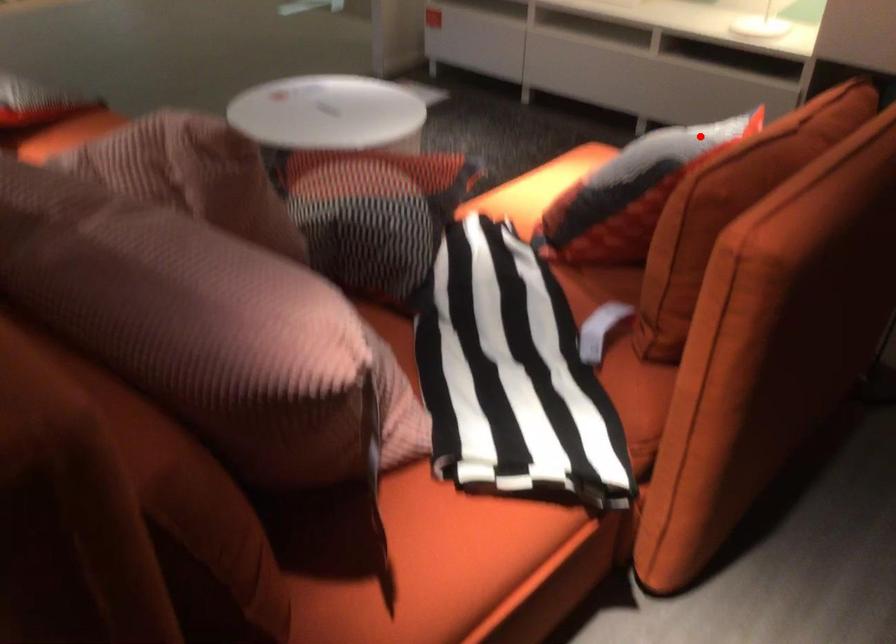
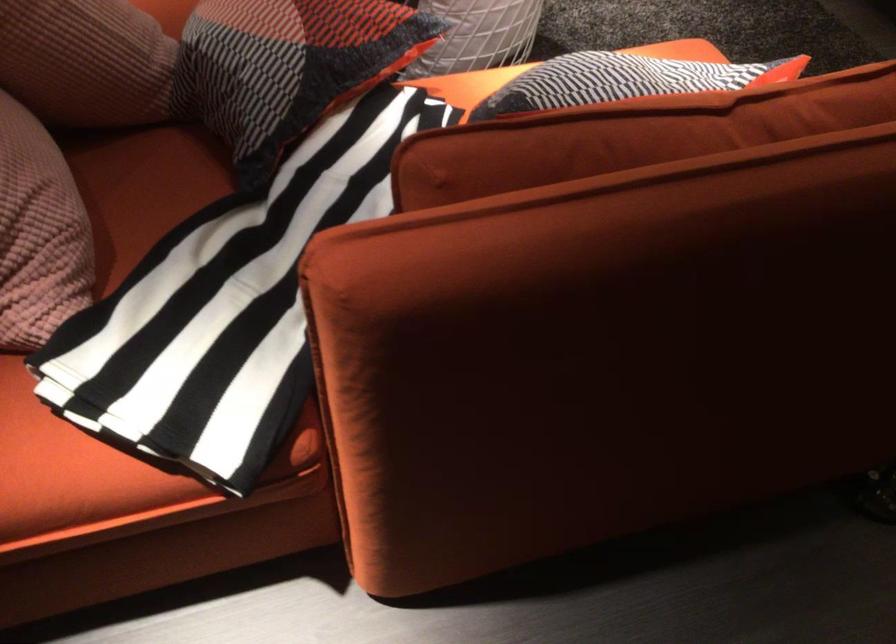
Question: I am providing you with two images of the same scene from different viewpoints. Image1 has a red point marked. In image2, the corresponding 3D location appears at what relative position? Reply with the corresponding letter.

Choices:
 (A) Closer
 (B) Farther

Answer: (A)